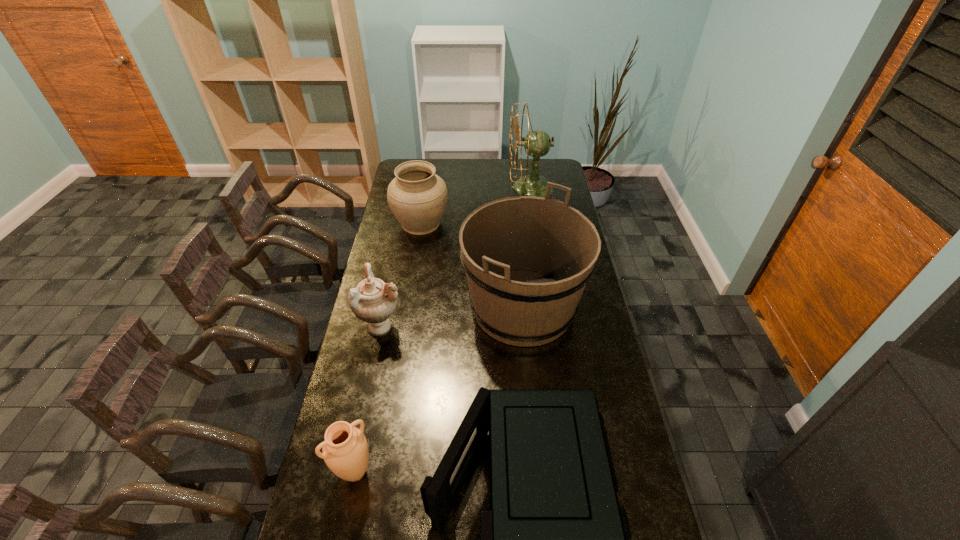
Where is `fan`? The height and width of the screenshot is (540, 960). fan is located at coordinates (537, 143).

Where is `bucket`? bucket is located at coordinates (527, 259).

In order to click on the farthest urn in this screenshot , I will do `click(417, 197)`.

Find the location of a particular element. This screenshot has width=960, height=540. the second nearest urn is located at coordinates (373, 301).

At what (x,y) coordinates should I click in order to perform the action: click on the nearest urn. Please return your answer as a coordinate pair (x, y). The width and height of the screenshot is (960, 540). Looking at the image, I should click on 345,451.

The width and height of the screenshot is (960, 540). Identify the location of free space located in front of the fan, directing air flow. tap(468, 187).

Locate an element on the screen. free region located in front of the fan, directing air flow is located at coordinates (479, 187).

Locate an element on the screen. vacant space located 0.330m in front of the fan, directing air flow is located at coordinates (446, 187).

Identify the location of vacant space situated on the back of the bucket. (516, 230).

Where is `vacant space located on the right of the farthest urn`? This screenshot has height=540, width=960. vacant space located on the right of the farthest urn is located at coordinates (508, 223).